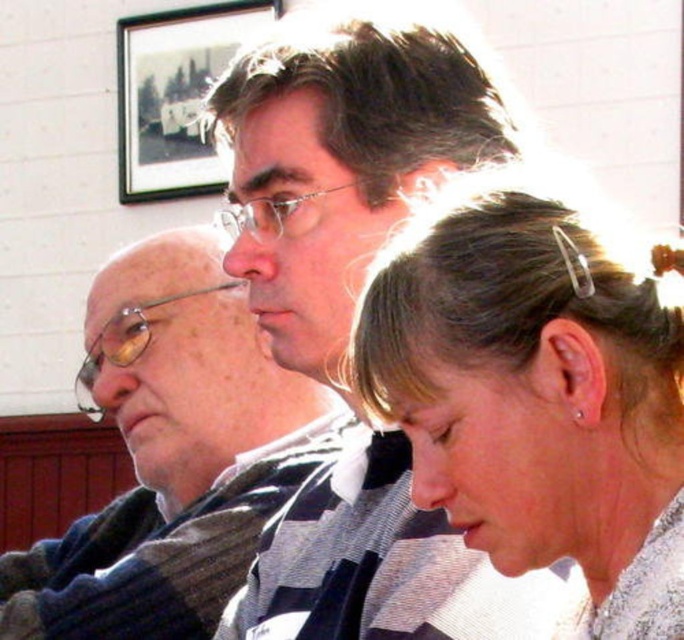
Question: Which of these objects is positioned farthest from the matte gray scarf at left?

Choices:
 (A) wooden framed picture at upper center
 (B) sleek silver hair clip at upper right

Answer: (A)

Question: Does matte gray scarf at left appear over wooden framed picture at upper center?

Choices:
 (A) yes
 (B) no

Answer: (B)

Question: Which object appears farthest from the camera in this image?

Choices:
 (A) sleek silver hair clip at upper right
 (B) matte gray scarf at left

Answer: (B)

Question: Which object is positioned closest to the wooden framed picture at upper center?

Choices:
 (A) sleek silver hair clip at upper right
 (B) matte gray scarf at left

Answer: (B)

Question: Is matte gray scarf at left further to the viewer compared to wooden framed picture at upper center?

Choices:
 (A) yes
 (B) no

Answer: (B)

Question: Can you confirm if matte gray scarf at left is wider than wooden framed picture at upper center?

Choices:
 (A) no
 (B) yes

Answer: (B)